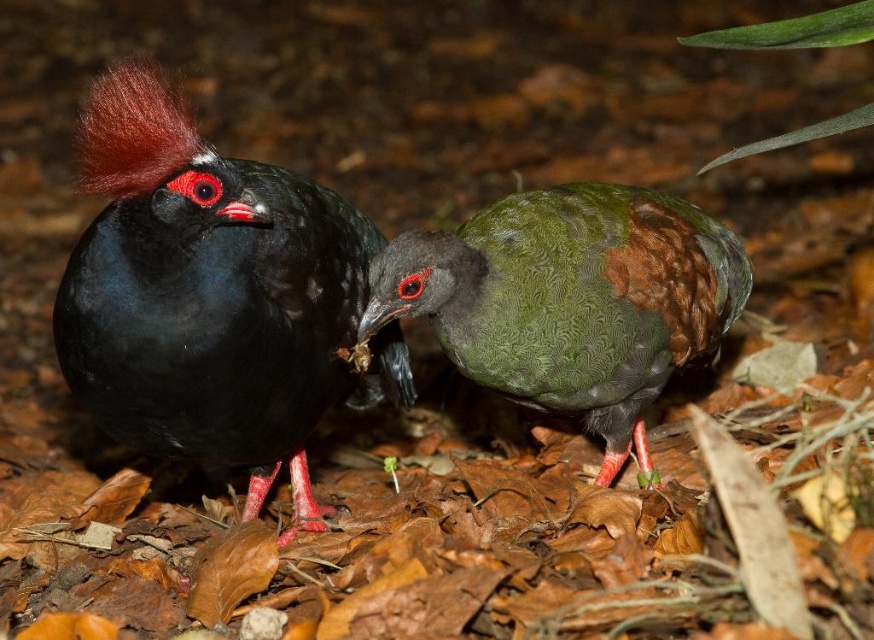
Question: Is shiny black bird at left positioned at the back of green textured bird at center?

Choices:
 (A) yes
 (B) no

Answer: (B)

Question: Among these points, which one is nearest to the camera?

Choices:
 (A) (615, 198)
 (B) (286, 228)

Answer: (B)

Question: Which object is closer to the camera taking this photo?

Choices:
 (A) shiny black bird at left
 (B) green textured bird at center

Answer: (A)

Question: Which point appears farthest from the camera in this image?

Choices:
 (A) (115, 381)
 (B) (592, 292)

Answer: (B)

Question: Is shiny black bird at left further to camera compared to green textured bird at center?

Choices:
 (A) yes
 (B) no

Answer: (B)

Question: Can you confirm if shiny black bird at left is positioned below green textured bird at center?

Choices:
 (A) no
 (B) yes

Answer: (A)